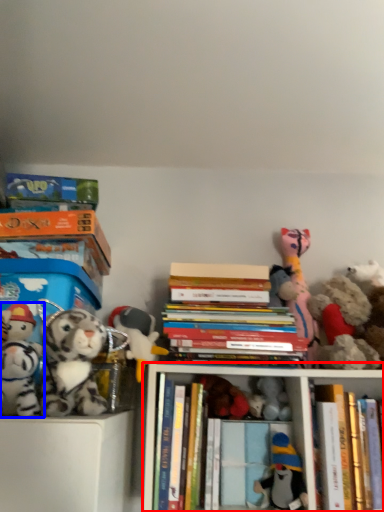
Question: Which object is closer to the camera taking this photo, shelf (highlighted by a red box) or toy (highlighted by a blue box)?

Choices:
 (A) shelf
 (B) toy

Answer: (B)